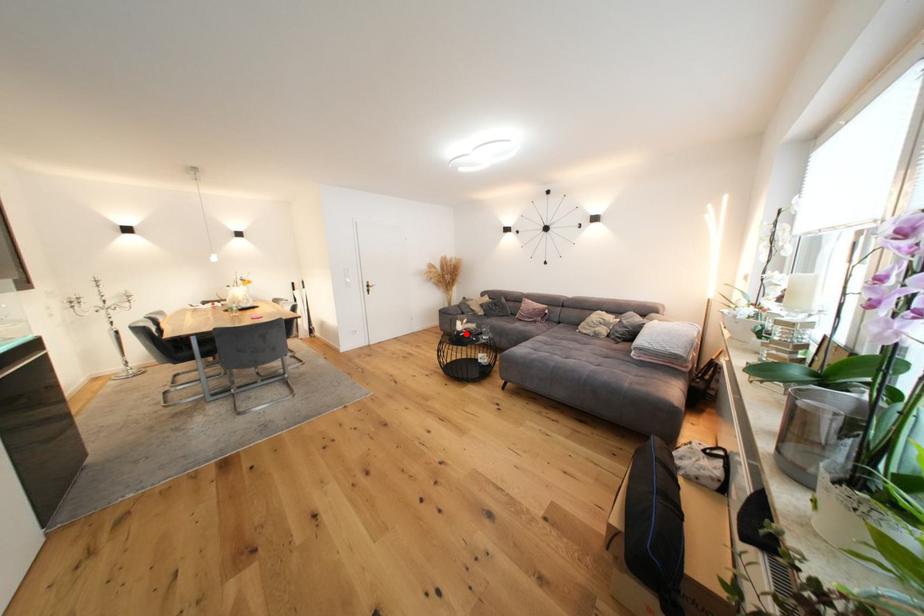
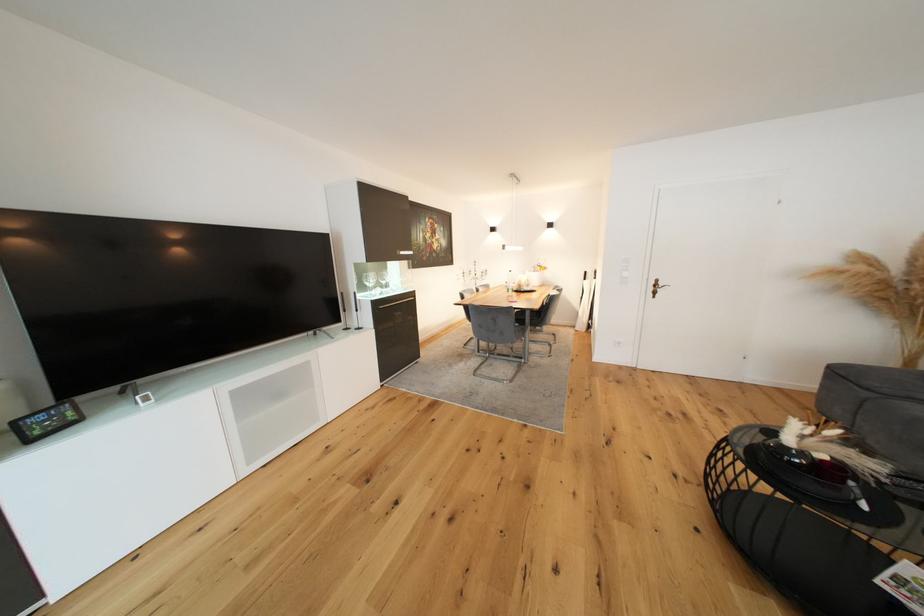
Question: A red point is marked in image1. In image2, is the corresponding 3D point closer to the camera or farther? Reply with the corresponding letter.

Choices:
 (A) The corresponding 3D point is closer.
 (B) The corresponding 3D point is farther.

Answer: (A)